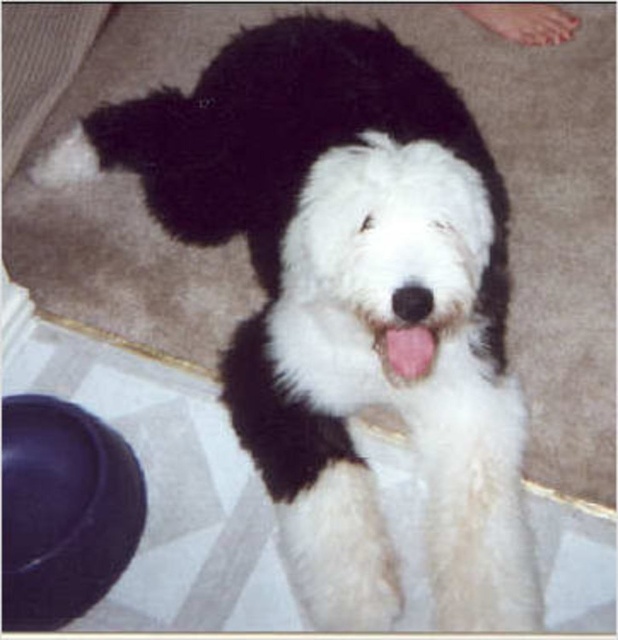
In the scene shown: Is white fur paw at upper right bigger than pink flesh at center?

Indeed, white fur paw at upper right has a larger size compared to pink flesh at center.

Is white fur paw at upper right in front of pink flesh at center?

No, it is behind pink flesh at center.

What are the coordinates of `white fur paw at upper right` in the screenshot? It's located at (525, 20).